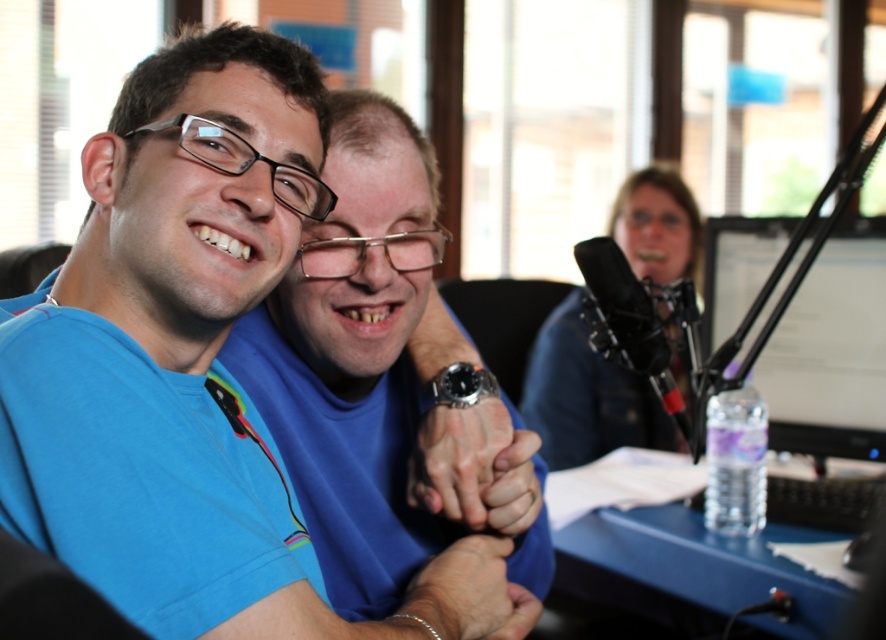
Does matte black monitor at right appear on the right side of blue plastic table at lower right?

Indeed, matte black monitor at right is positioned on the right side of blue plastic table at lower right.

Between matte black monitor at right and blue plastic table at lower right, which one is positioned lower?

blue plastic table at lower right is below.

This screenshot has width=886, height=640. Describe the element at coordinates (830, 352) in the screenshot. I see `matte black monitor at right` at that location.

Locate an element on the screen. matte black monitor at right is located at coordinates (830, 352).

Who is higher up, blue fabric shirt at center or smooth skin hand at center?

blue fabric shirt at center is above.

The image size is (886, 640). I want to click on blue fabric shirt at center, so click(587, 396).

Image resolution: width=886 pixels, height=640 pixels. I want to click on blue fabric shirt at center, so click(587, 396).

Between point (206, 35) and point (836, 618), which one is positioned behind?

The point (836, 618) is more distant.

Between blue matte shirt at center and blue plastic table at lower right, which one is positioned higher?

Positioned higher is blue matte shirt at center.

Who is more forward, [125,531] or [627,454]?

Point [125,531] is more forward.

Where is `blue matte shirt at center`? blue matte shirt at center is located at coordinates (175, 352).